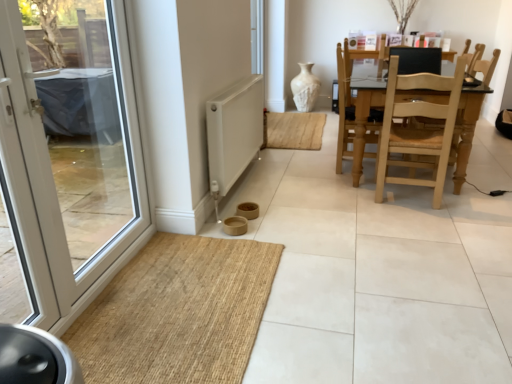
Question: Does brown woven mat at lower left contain light wood/wooden chair at right?

Choices:
 (A) yes
 (B) no

Answer: (B)

Question: Is light wood/wooden chair at right at the back of brown woven mat at lower left?

Choices:
 (A) no
 (B) yes

Answer: (A)

Question: From a real-world perspective, is brown woven mat at lower left under light wood/wooden chair at right?

Choices:
 (A) yes
 (B) no

Answer: (A)

Question: Is the position of brown woven mat at lower left more distant than that of light wood/wooden chair at right?

Choices:
 (A) no
 (B) yes

Answer: (A)

Question: Considering the relative sizes of brown woven mat at lower left and light wood/wooden chair at right in the image provided, is brown woven mat at lower left smaller than light wood/wooden chair at right?

Choices:
 (A) yes
 (B) no

Answer: (A)

Question: Is brown woven mat at lower left positioned in front of light wood/wooden chair at right?

Choices:
 (A) yes
 (B) no

Answer: (A)

Question: Is brown woven mat at lower left shorter than white textured vase at center?

Choices:
 (A) no
 (B) yes

Answer: (B)

Question: Considering the relative sizes of brown woven mat at lower left and white textured vase at center in the image provided, is brown woven mat at lower left thinner than white textured vase at center?

Choices:
 (A) yes
 (B) no

Answer: (B)

Question: Is brown woven mat at lower left bigger than white textured vase at center?

Choices:
 (A) yes
 (B) no

Answer: (B)

Question: From the image's perspective, would you say brown woven mat at lower left is shown under white textured vase at center?

Choices:
 (A) no
 (B) yes

Answer: (B)

Question: Does brown woven mat at lower left have a greater width compared to white textured vase at center?

Choices:
 (A) no
 (B) yes

Answer: (B)

Question: Is brown woven mat at lower left at the right side of white textured vase at center?

Choices:
 (A) yes
 (B) no

Answer: (B)

Question: Is white textured vase at center behind light brown wooden swivel chair at center?

Choices:
 (A) no
 (B) yes

Answer: (B)